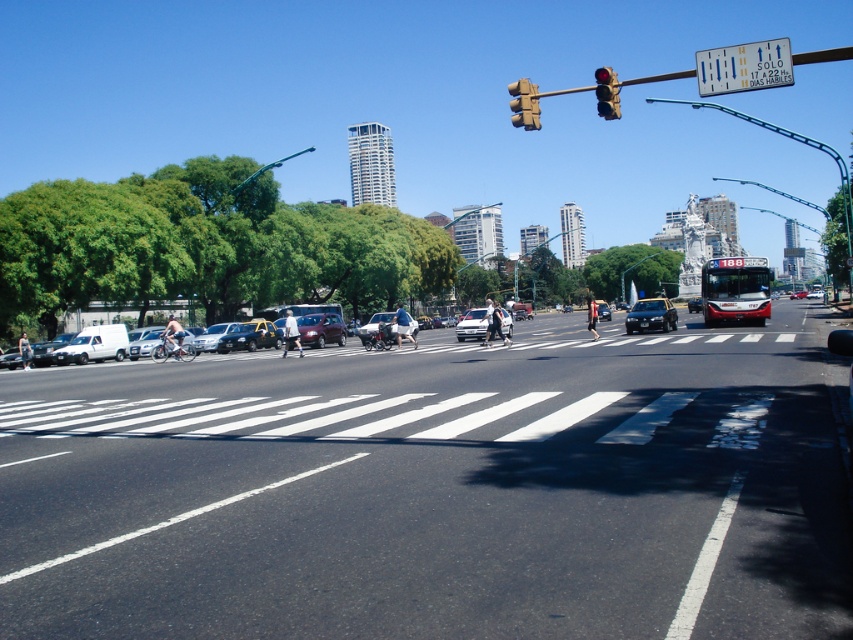
Which of these two, white matte van at left or white glossy sedan at center, stands taller?

white matte van at left is taller.

Is point (70, 342) less distant than point (456, 330)?

No.

Does point (96, 349) come farther from viewer compared to point (506, 323)?

Yes.

Locate an element on the screen. This screenshot has width=853, height=640. white matte van at left is located at coordinates point(94,344).

Which of these two, shiny metallic sedan at center or metallic traffic light at upper center, stands shorter?

shiny metallic sedan at center

What do you see at coordinates (320, 330) in the screenshot? I see `shiny metallic sedan at center` at bounding box center [320, 330].

Locate an element on the screen. The image size is (853, 640). shiny metallic sedan at center is located at coordinates (320, 330).

The image size is (853, 640). Find the location of `white asphalt road at center`. white asphalt road at center is located at coordinates [x=434, y=490].

Between point (645, 525) and point (508, 326), which one is positioned in front?

Point (645, 525) is in front.

Which is behind, point (770, 376) or point (457, 336)?

The point (457, 336) is more distant.

The height and width of the screenshot is (640, 853). Find the location of `white asphalt road at center`. white asphalt road at center is located at coordinates (434, 490).